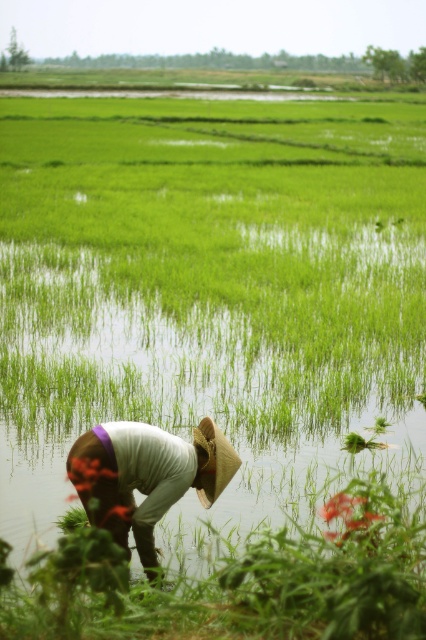
Question: Can you confirm if white cotton shirt at lower center is wider than strawmaterial/texturehat at lower center?

Choices:
 (A) yes
 (B) no

Answer: (A)

Question: Considering the relative positions of white cotton shirt at lower center and strawmaterial/texturehat at lower center in the image provided, where is white cotton shirt at lower center located with respect to strawmaterial/texturehat at lower center?

Choices:
 (A) below
 (B) above

Answer: (A)

Question: Which object is closer to the camera taking this photo?

Choices:
 (A) strawmaterial/texturehat at lower center
 (B) white cotton shirt at lower center

Answer: (B)

Question: Can you confirm if white cotton shirt at lower center is positioned to the left of strawmaterial/texturehat at lower center?

Choices:
 (A) yes
 (B) no

Answer: (A)